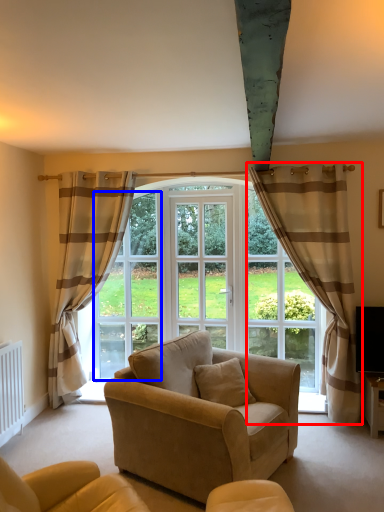
Question: Which object appears closest to the camera in this image, curtain (highlighted by a red box) or window screen (highlighted by a blue box)?

Choices:
 (A) curtain
 (B) window screen

Answer: (A)